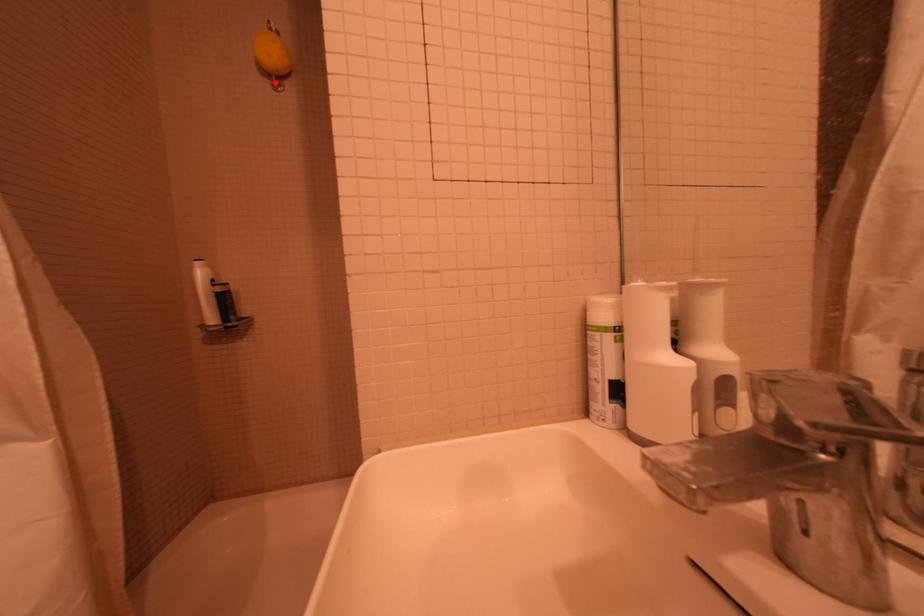
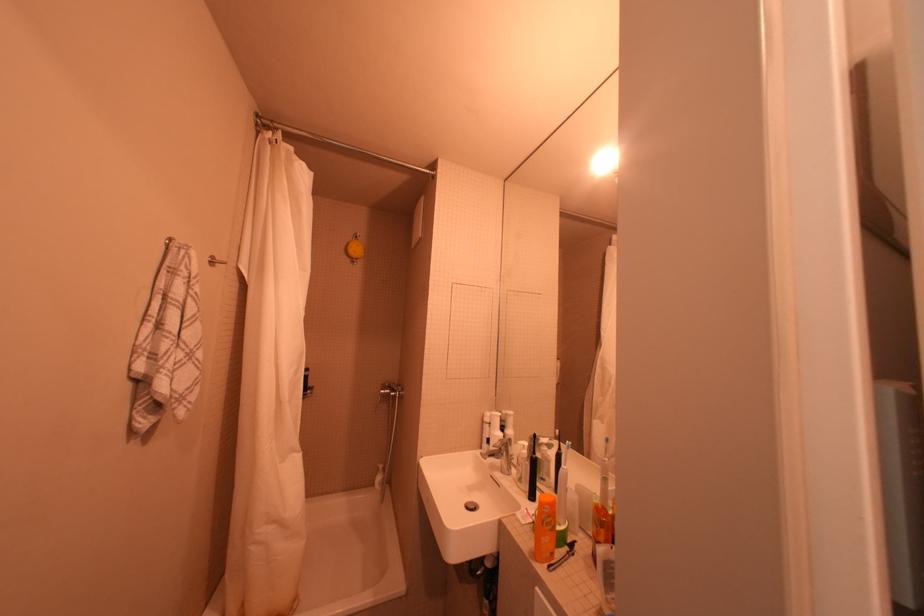
Find the pixel in the second image that matches the highlighted location in the first image.

(358, 261)